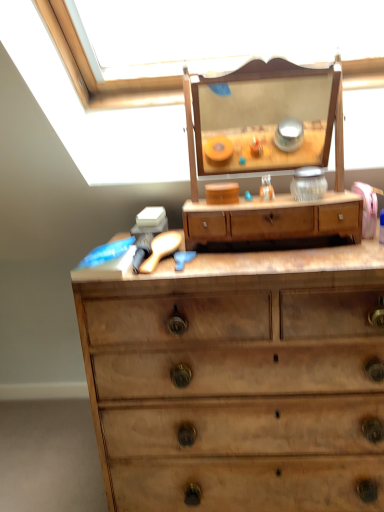
Question: From the image's perspective, is wooden drawer at center above or below wooden chest of drawers at center?

Choices:
 (A) above
 (B) below

Answer: (A)

Question: In terms of size, does wooden drawer at center appear bigger or smaller than wooden chest of drawers at center?

Choices:
 (A) small
 (B) big

Answer: (A)

Question: From a real-world perspective, relative to wooden chest of drawers at center, is wooden drawer at center vertically above or below?

Choices:
 (A) above
 (B) below

Answer: (A)

Question: Is wooden chest of drawers at center to the left or to the right of wooden drawer at center in the image?

Choices:
 (A) left
 (B) right

Answer: (B)

Question: From a real-world perspective, relative to wooden drawer at center, is wooden chest of drawers at center vertically above or below?

Choices:
 (A) below
 (B) above

Answer: (A)

Question: Considering the positions of point (188, 315) and point (304, 221), is point (188, 315) closer or farther from the camera than point (304, 221)?

Choices:
 (A) farther
 (B) closer

Answer: (B)

Question: Is wooden chest of drawers at center bigger or smaller than wooden drawer at center?

Choices:
 (A) big
 (B) small

Answer: (A)